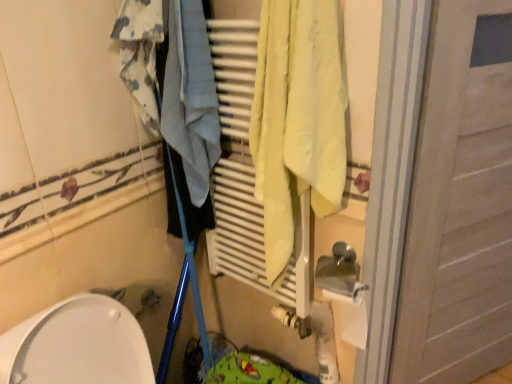
Question: Is blue printed fabric at upper left to the right of white wooden door at right from the viewer's perspective?

Choices:
 (A) yes
 (B) no

Answer: (B)

Question: Is blue printed fabric at upper left smaller than white wooden door at right?

Choices:
 (A) yes
 (B) no

Answer: (A)

Question: From a real-world perspective, is blue printed fabric at upper left physically above white wooden door at right?

Choices:
 (A) no
 (B) yes

Answer: (B)

Question: Does blue printed fabric at upper left touch white wooden door at right?

Choices:
 (A) yes
 (B) no

Answer: (B)

Question: Is blue printed fabric at upper left bigger than white wooden door at right?

Choices:
 (A) no
 (B) yes

Answer: (A)

Question: Is white wooden door at right at the back of blue printed fabric at upper left?

Choices:
 (A) yes
 (B) no

Answer: (B)

Question: Is white wooden door at right closer to camera compared to blue printed fabric at upper left?

Choices:
 (A) no
 (B) yes

Answer: (B)

Question: From the image's perspective, does white wooden door at right appear lower than blue printed fabric at upper left?

Choices:
 (A) yes
 (B) no

Answer: (A)

Question: From a real-world perspective, is white wooden door at right on top of blue printed fabric at upper left?

Choices:
 (A) yes
 (B) no

Answer: (B)

Question: Does white wooden door at right have a larger size compared to blue printed fabric at upper left?

Choices:
 (A) no
 (B) yes

Answer: (B)

Question: Is white wooden door at right aimed at blue printed fabric at upper left?

Choices:
 (A) yes
 (B) no

Answer: (B)

Question: Can you confirm if white wooden door at right is wider than blue printed fabric at upper left?

Choices:
 (A) yes
 (B) no

Answer: (B)

Question: Is blue printed fabric at upper left situated inside white wooden door at right or outside?

Choices:
 (A) inside
 (B) outside

Answer: (B)